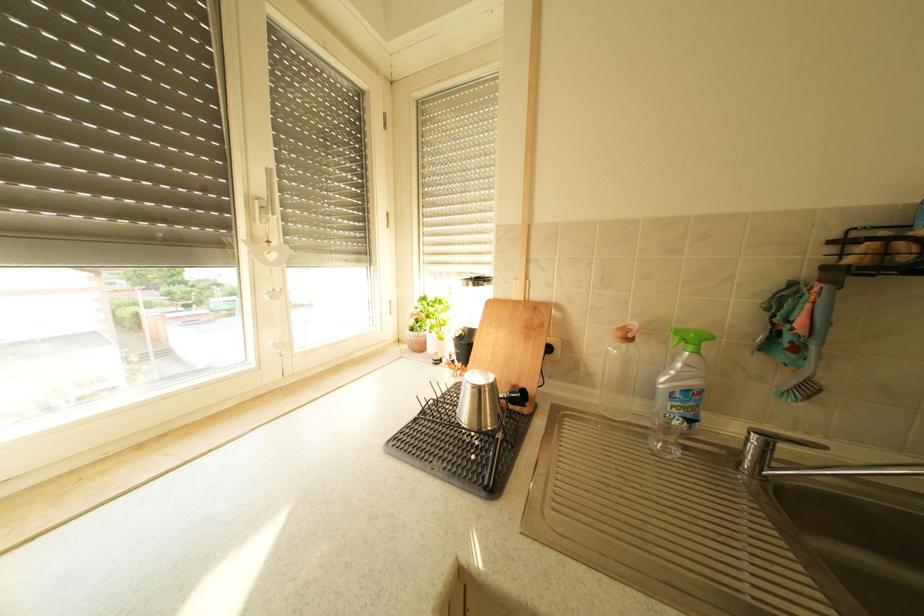
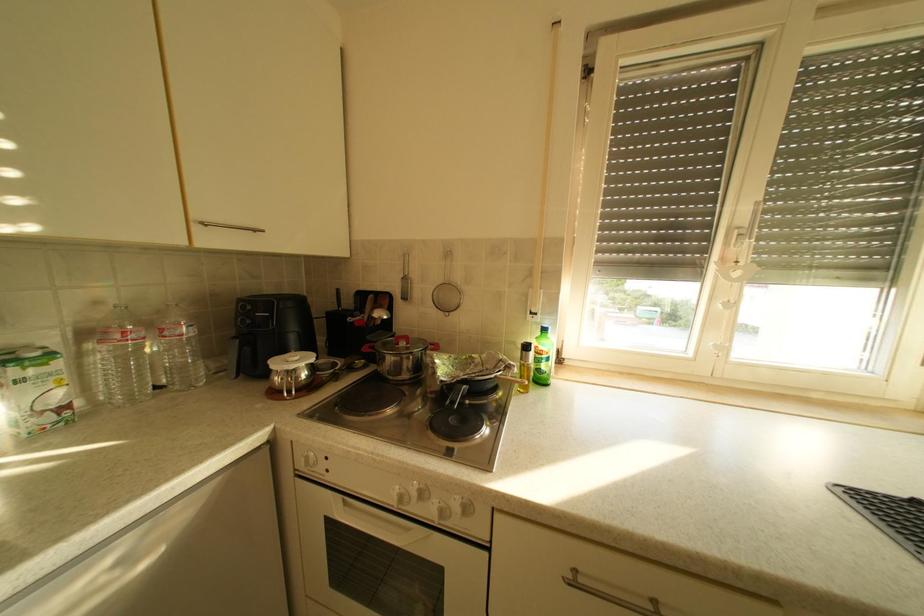
Question: The camera is either moving clockwise (left) or counter-clockwise (right) around the object. The first image is from the beginning of the video and the second image is from the end. Is the camera moving left or right when shooting the video?

Choices:
 (A) Left
 (B) Right

Answer: (B)